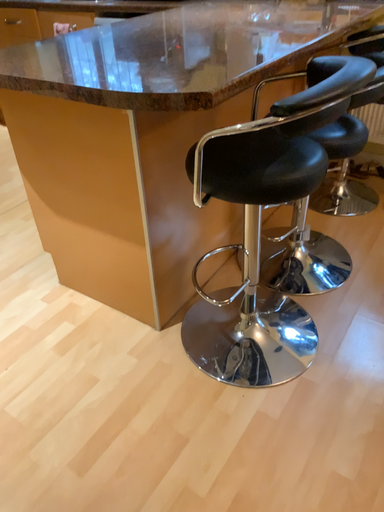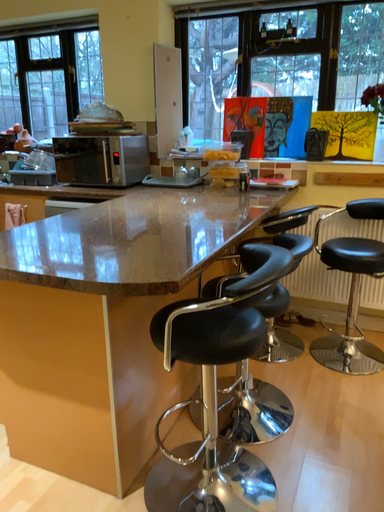
Question: How did the camera likely rotate when shooting the video?

Choices:
 (A) rotated downward
 (B) rotated upward

Answer: (B)